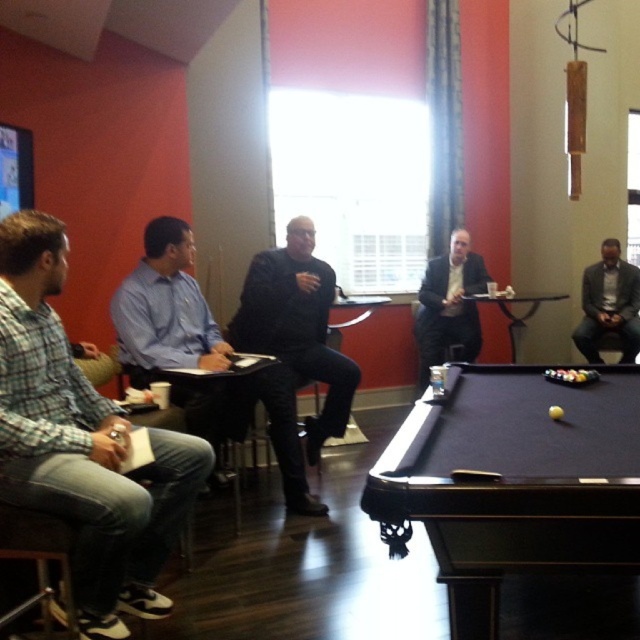
Is black matte jacket at center thinner than matte black suit at center?

No, black matte jacket at center is not thinner than matte black suit at center.

Does point (314, 285) lie behind point (445, 348)?

That is False.

At what (x,y) coordinates should I click in order to perform the action: click on black matte jacket at center. Please return your answer as a coordinate pair (x, y). Looking at the image, I should click on (298, 324).

Is plaid cotton shirt at left further to camera compared to black matte jacket at center?

No.

Does plaid cotton shirt at left appear over black matte jacket at center?

No, plaid cotton shirt at left is not above black matte jacket at center.

Who is more distant from viewer, (19, 308) or (289, 252)?

The point (289, 252) is behind.

The height and width of the screenshot is (640, 640). I want to click on plaid cotton shirt at left, so click(x=81, y=444).

Is plaid cotton shirt at left bigger than dark gray suit at center?

Yes.

Is point (20, 456) more distant than point (628, 266)?

That is False.

At what (x,y) coordinates should I click in order to perform the action: click on plaid cotton shirt at left. Please return your answer as a coordinate pair (x, y). Image resolution: width=640 pixels, height=640 pixels. Looking at the image, I should click on (81, 444).